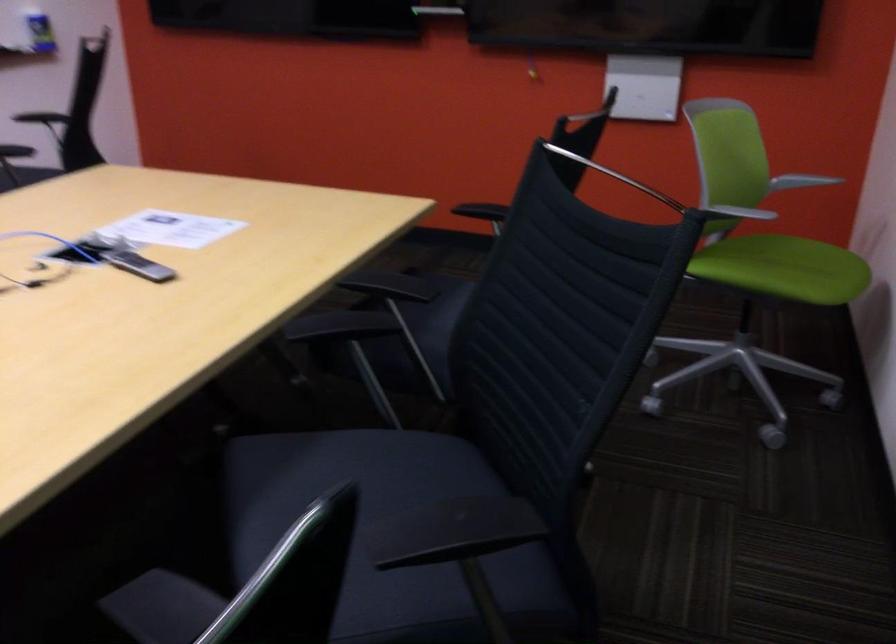
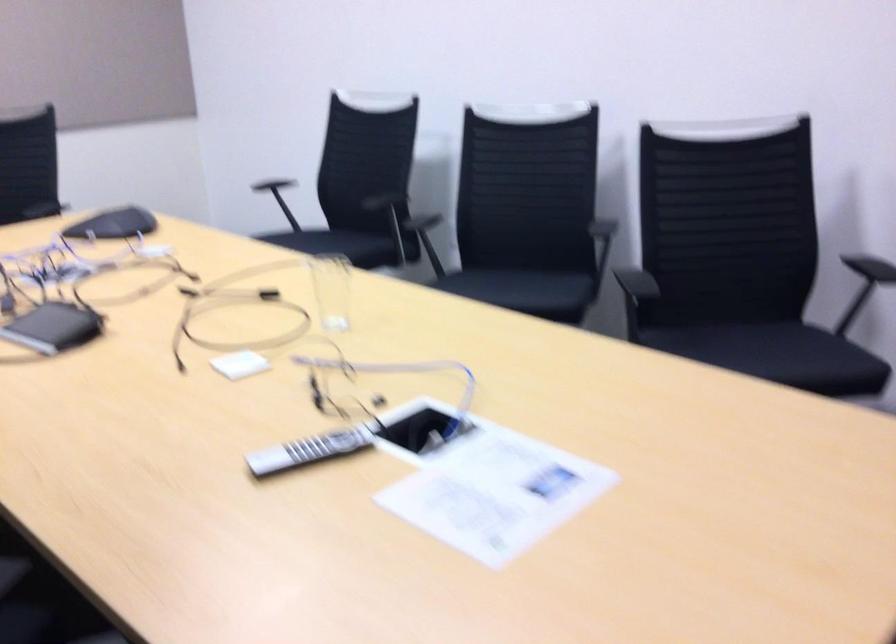
Where in the second image is the point corresponding to (x=152, y=265) from the first image?

(308, 450)